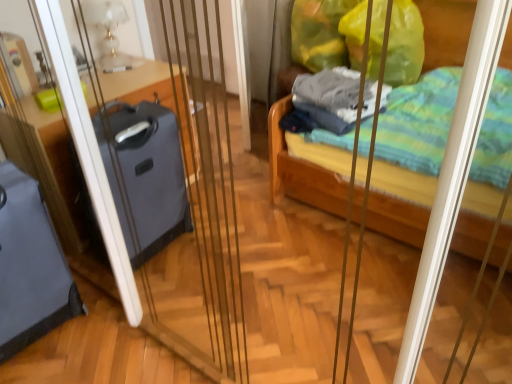
Consider the image. What is the approximate width of matte gray suitcase at left?

It is 11.54 inches.

The width and height of the screenshot is (512, 384). Describe the element at coordinates (30, 266) in the screenshot. I see `matte gray suitcase at left` at that location.

The image size is (512, 384). I want to click on matte gray suitcase at left, so click(30, 266).

You are a GUI agent. You are given a task and a screenshot of the screen. Output one action in this format:
    pyautogui.click(x=<x>, y=<y>)
    Task: Click on the matte gray suitcase at left
    Image resolution: width=512 pixels, height=384 pixels.
    Given the screenshot: What is the action you would take?
    pyautogui.click(x=30, y=266)